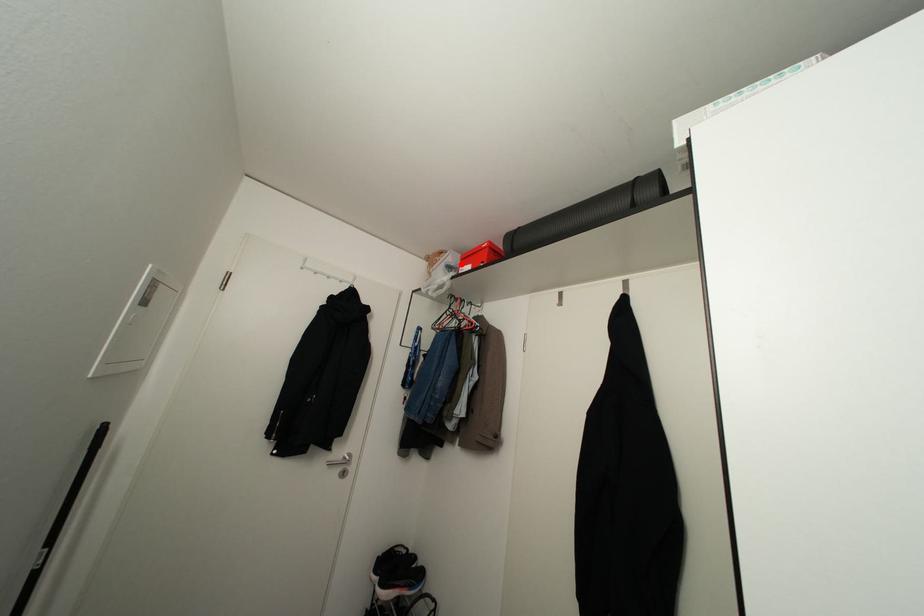
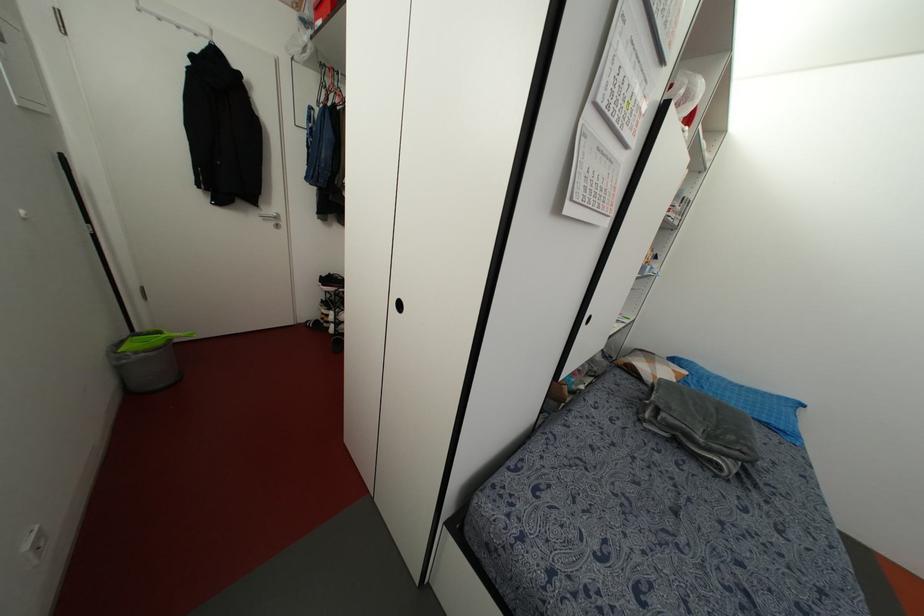
The point at the highlighted location is marked in the first image. Where is the corresponding point in the second image?

(315, 18)